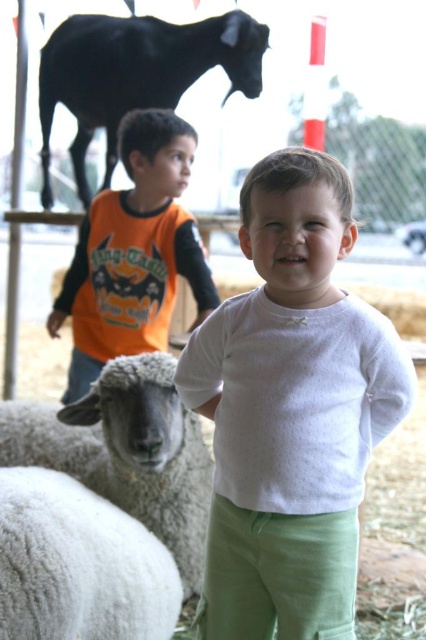
You are a photographer trying to capture a photo of the white fluffy wool at lower left. You want to ensure the white soft shirt at center doesn

The white soft shirt at center is taller than the white fluffy wool at lower left, so if you position yourself so the shirt is behind the wool, the wool will appear in front and be the main focus of the photo.